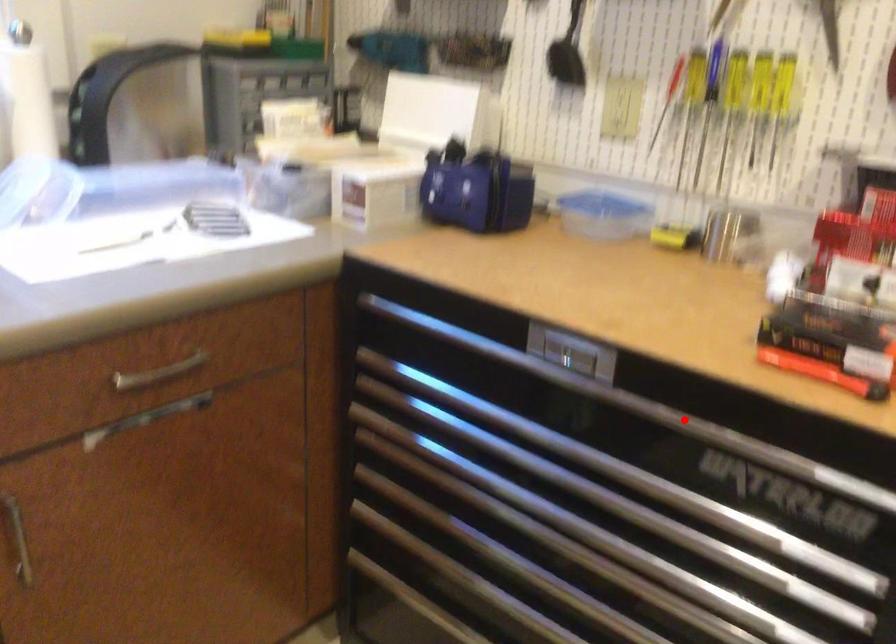
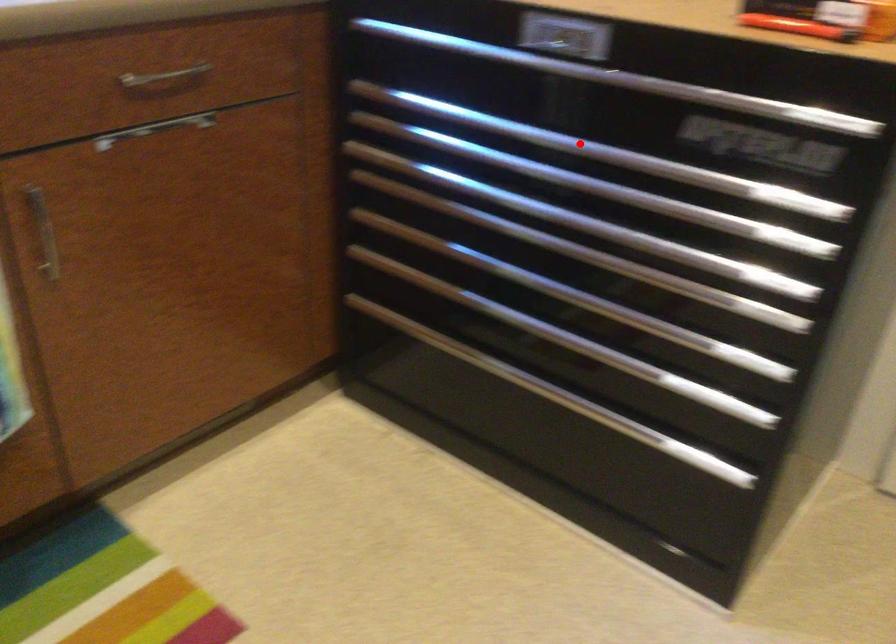
I am providing you with two images of the same scene from different viewpoints. A red point is marked on the first image and another point is marked on the second image. Is the marked point in image1 the same physical position as the marked point in image2?

No